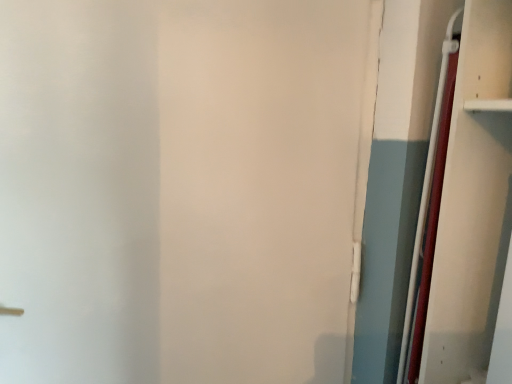
What do you see at coordinates (261, 184) in the screenshot? The width and height of the screenshot is (512, 384). I see `white matte screen door at left` at bounding box center [261, 184].

Identify the location of white matte screen door at left. (261, 184).

Locate an element on the screen. The width and height of the screenshot is (512, 384). white matte screen door at left is located at coordinates (261, 184).